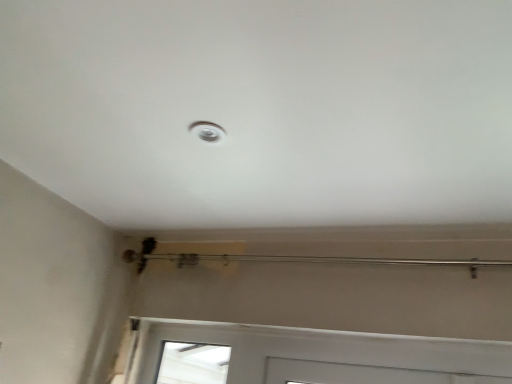
Describe the element at coordinates (207, 131) in the screenshot. I see `white glossy droplight at upper center` at that location.

Locate an element on the screen. The image size is (512, 384). white glossy droplight at upper center is located at coordinates (207, 131).

I want to click on white glossy droplight at upper center, so click(207, 131).